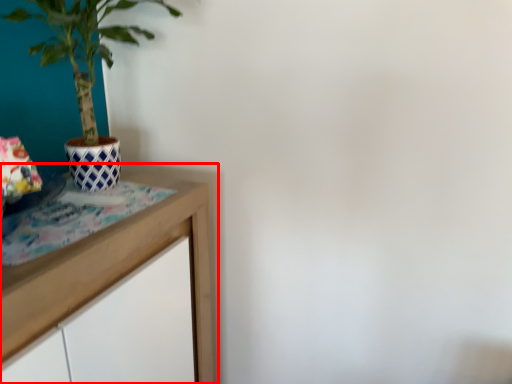
Question: Considering the relative positions of table (annotated by the red box) and houseplant in the image provided, where is table (annotated by the red box) located with respect to the staircase?

Choices:
 (A) left
 (B) right

Answer: (A)